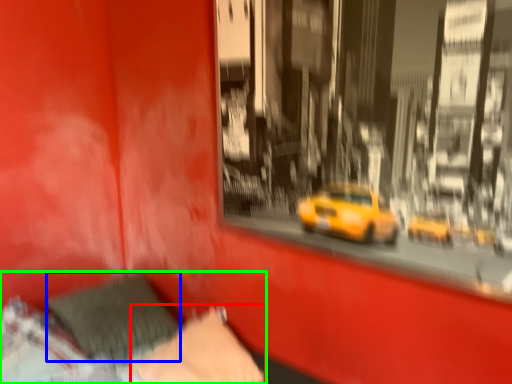
Question: Which object is positioned closest to pillow (highlighted by a red box)? Select from pillow (highlighted by a blue box) and bed (highlighted by a green box).

Choices:
 (A) pillow
 (B) bed

Answer: (B)